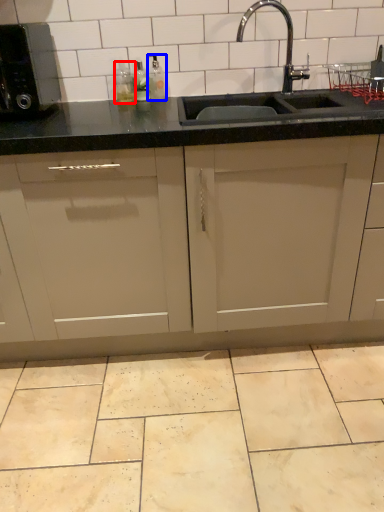
Question: Among these objects, which one is nearest to the camera, bottle (highlighted by a red box) or bottle (highlighted by a blue box)?

Choices:
 (A) bottle
 (B) bottle

Answer: (B)